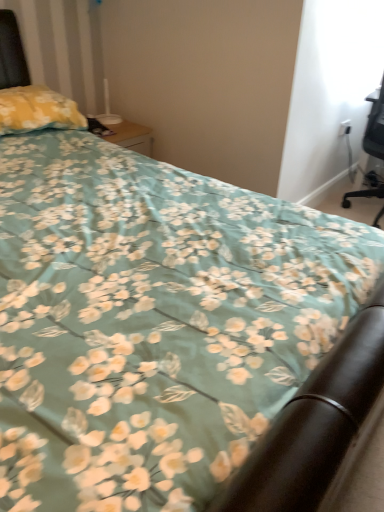
Describe the element at coordinates (37, 110) in the screenshot. I see `yellow plush pillow at upper left` at that location.

Identify the location of yellow plush pillow at upper left. (37, 110).

The image size is (384, 512). Identify the location of yellow plush pillow at upper left. (37, 110).